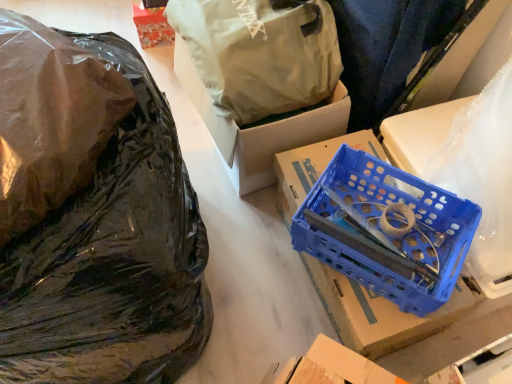
Question: Is transparent plastic bag at left, which appears as the second plastic bag when ordered from the bottom, further to the viewer compared to white cardboard box at upper center, the 2th box viewed from the front?

Choices:
 (A) yes
 (B) no

Answer: (B)

Question: From the image's perspective, is transparent plastic bag at left, which appears as the second plastic bag when ordered from the bottom, under white cardboard box at upper center, the 2th box viewed from the front?

Choices:
 (A) no
 (B) yes

Answer: (B)

Question: Does transparent plastic bag at left, placed as the second plastic bag when sorted from top to bottom, have a larger size compared to white cardboard box at upper center, placed as the first box when sorted from back to front?

Choices:
 (A) no
 (B) yes

Answer: (A)

Question: Is white cardboard box at upper center, placed as the first box when sorted from back to front, a part of transparent plastic bag at left, which appears as the second plastic bag when ordered from the bottom?

Choices:
 (A) yes
 (B) no

Answer: (B)

Question: Does transparent plastic bag at left, placed as the second plastic bag when sorted from top to bottom, have a greater width compared to white cardboard box at upper center, placed as the first box when sorted from back to front?

Choices:
 (A) yes
 (B) no

Answer: (A)

Question: Is black plastic bag at left, which ranks as the 3th plastic bag in top-to-bottom order, bigger or smaller than white cardboard box at upper center, the 2th box viewed from the front?

Choices:
 (A) big
 (B) small

Answer: (A)

Question: From their relative heights in the image, would you say black plastic bag at left, positioned as the 1th plastic bag in bottom-to-top order, is taller or shorter than white cardboard box at upper center, placed as the first box when sorted from back to front?

Choices:
 (A) tall
 (B) short

Answer: (A)

Question: In the image, is black plastic bag at left, which ranks as the 3th plastic bag in top-to-bottom order, on the left side or the right side of white cardboard box at upper center, the 2th box viewed from the front?

Choices:
 (A) left
 (B) right

Answer: (A)

Question: Is black plastic bag at left, which ranks as the 3th plastic bag in top-to-bottom order, wider or thinner than white cardboard box at upper center, placed as the first box when sorted from back to front?

Choices:
 (A) wide
 (B) thin

Answer: (A)

Question: Is point (100, 145) positioned closer to the camera than point (317, 18)?

Choices:
 (A) farther
 (B) closer

Answer: (B)

Question: Considering the positions of black plastic bag at left, which ranks as the 3th plastic bag in top-to-bottom order, and matte white plastic bag at upper center, which is the 3th plastic bag in bottom-to-top order, in the image, is black plastic bag at left, which ranks as the 3th plastic bag in top-to-bottom order, bigger or smaller than matte white plastic bag at upper center, which is the 3th plastic bag in bottom-to-top order,?

Choices:
 (A) big
 (B) small

Answer: (A)

Question: From the image's perspective, is black plastic bag at left, which ranks as the 3th plastic bag in top-to-bottom order, positioned above or below matte white plastic bag at upper center, which ranks as the 1th plastic bag in top-to-bottom order?

Choices:
 (A) above
 (B) below

Answer: (B)

Question: Considering the positions of black plastic bag at left, which ranks as the 3th plastic bag in top-to-bottom order, and matte white plastic bag at upper center, which ranks as the 1th plastic bag in top-to-bottom order, in the image, is black plastic bag at left, which ranks as the 3th plastic bag in top-to-bottom order, taller or shorter than matte white plastic bag at upper center, which ranks as the 1th plastic bag in top-to-bottom order,?

Choices:
 (A) short
 (B) tall

Answer: (B)

Question: From their relative heights in the image, would you say matte white plastic bag at upper center, which is the 3th plastic bag in bottom-to-top order, is taller or shorter than white cardboard box at upper center, the 2th box viewed from the front?

Choices:
 (A) tall
 (B) short

Answer: (B)

Question: Considering the positions of matte white plastic bag at upper center, which is the 3th plastic bag in bottom-to-top order, and white cardboard box at upper center, the 2th box viewed from the front, in the image, is matte white plastic bag at upper center, which is the 3th plastic bag in bottom-to-top order, wider or thinner than white cardboard box at upper center, the 2th box viewed from the front,?

Choices:
 (A) wide
 (B) thin

Answer: (A)